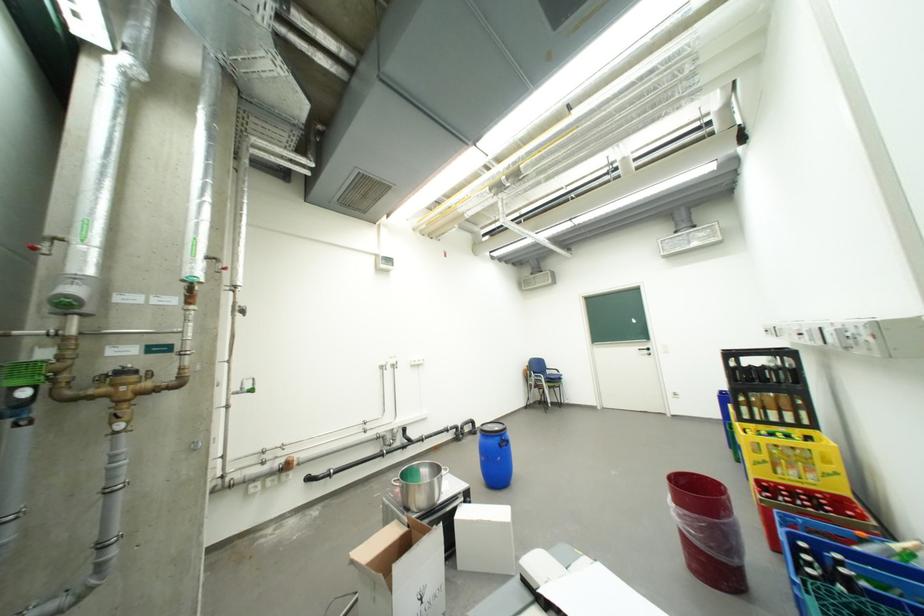
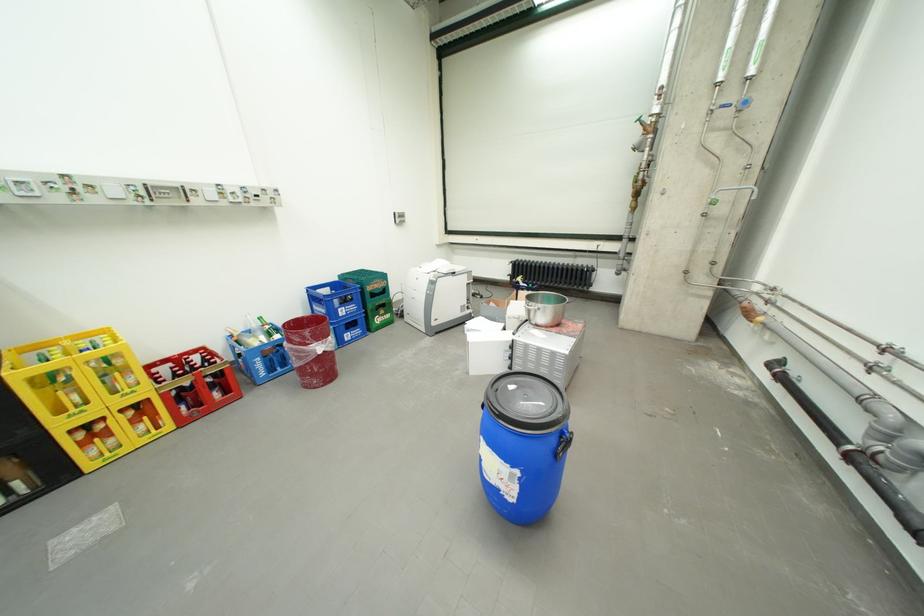
Find the pixel in the second image that matches (x=734, y=490) in the first image.

(297, 328)